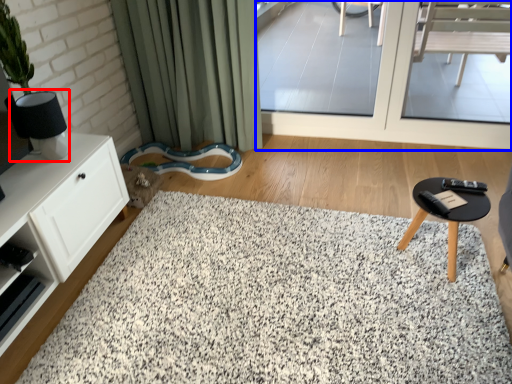
Question: Which of the following is the closest to the observer, lamp (highlighted by a red box) or window screen (highlighted by a blue box)?

Choices:
 (A) lamp
 (B) window screen

Answer: (A)